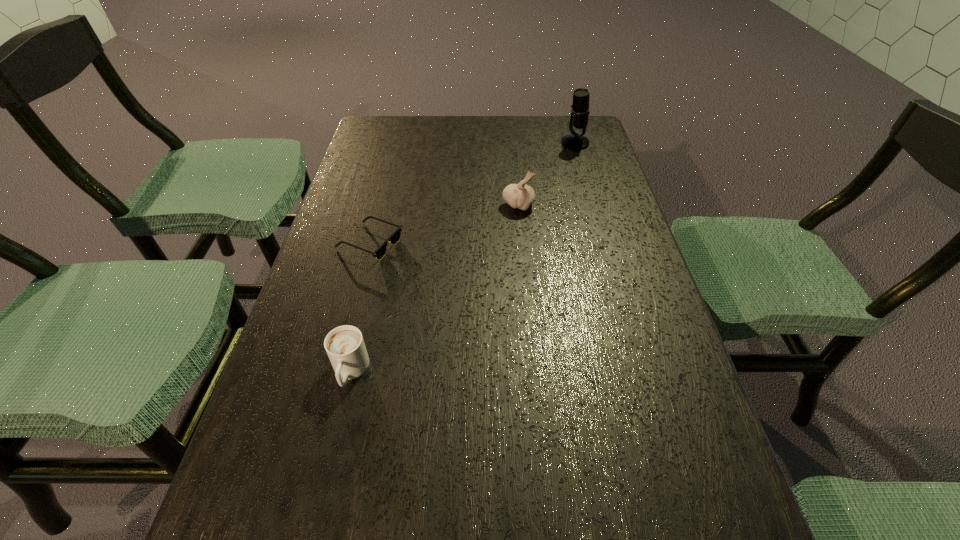
Find the location of a particular element. The width and height of the screenshot is (960, 540). the rightmost object is located at coordinates (580, 108).

Locate an element on the screen. This screenshot has height=540, width=960. the farthest object is located at coordinates (580, 108).

This screenshot has width=960, height=540. I want to click on the third nearest object, so click(521, 196).

Image resolution: width=960 pixels, height=540 pixels. Identify the location of the second tallest object. (521, 196).

Locate an element on the screen. The width and height of the screenshot is (960, 540). cappuccino is located at coordinates (345, 347).

Locate an element on the screen. the third tallest object is located at coordinates (345, 347).

Find the location of a particular element. sunglasses is located at coordinates (379, 253).

Identify the location of the second nearest object. The image size is (960, 540). (379, 253).

Where is `vacant space located on the front of the tallest object`? vacant space located on the front of the tallest object is located at coordinates (596, 214).

Locate an element on the screen. The width and height of the screenshot is (960, 540). vacant space situated 0.210m on the back of the garlic is located at coordinates (514, 155).